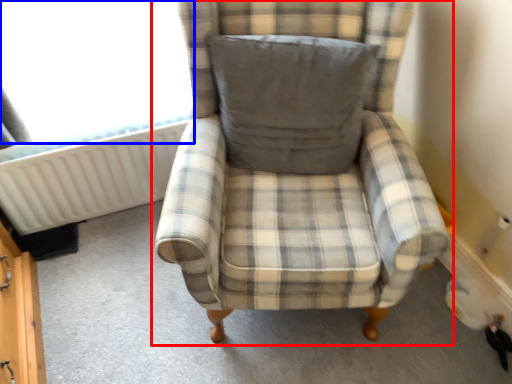
Question: Which object is closer to the camera taking this photo, chair (highlighted by a red box) or window screen (highlighted by a blue box)?

Choices:
 (A) chair
 (B) window screen

Answer: (A)